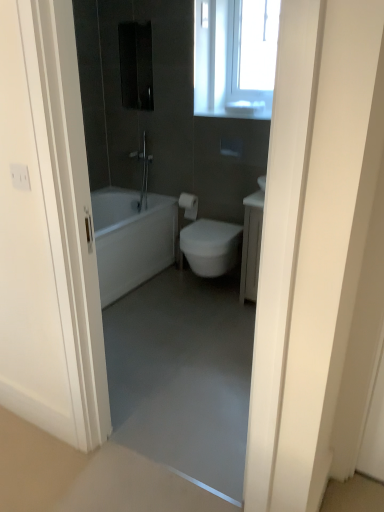
The height and width of the screenshot is (512, 384). Identify the location of vacant space underneath white glossy bidet at center (from a real-world perspective). (202, 292).